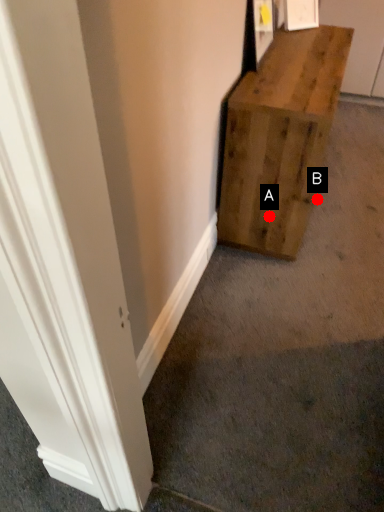
Question: Two points are circled on the image, labeled by A and B beside each circle. Which point is closer to the camera?

Choices:
 (A) A is closer
 (B) B is closer

Answer: (A)